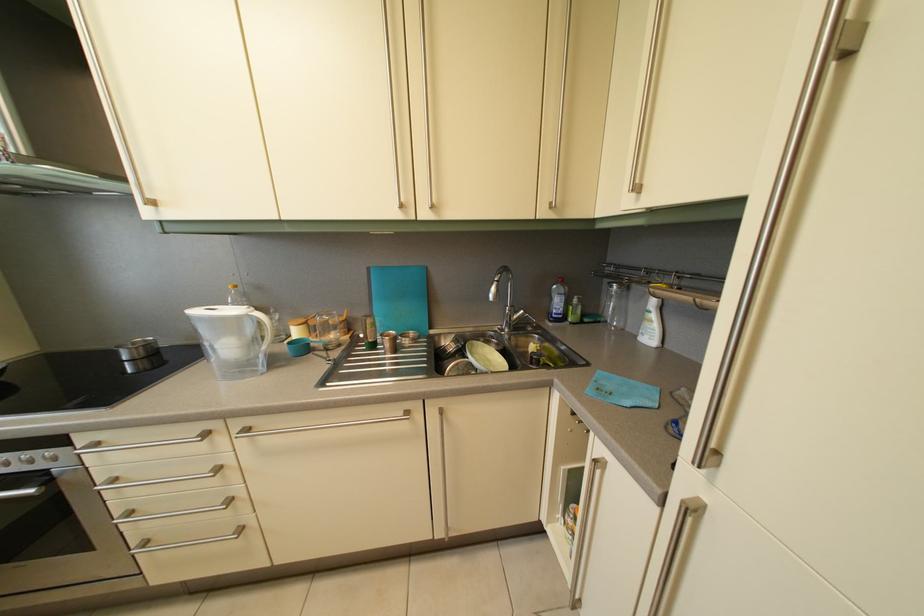
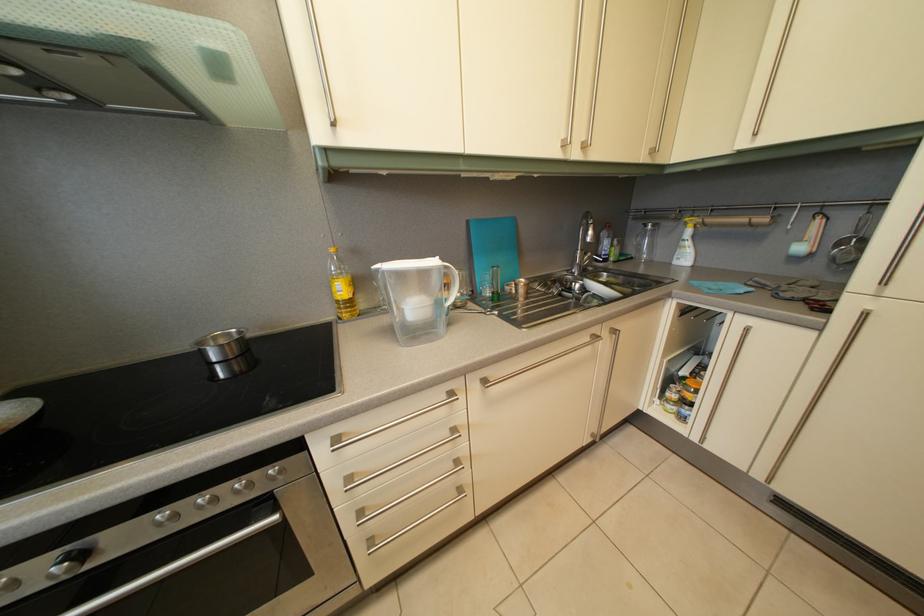
Question: In a continuous first-person perspective shot, in which direction is the camera moving?

Choices:
 (A) Left
 (B) Right
 (C) Forward
 (D) Backward

Answer: (A)